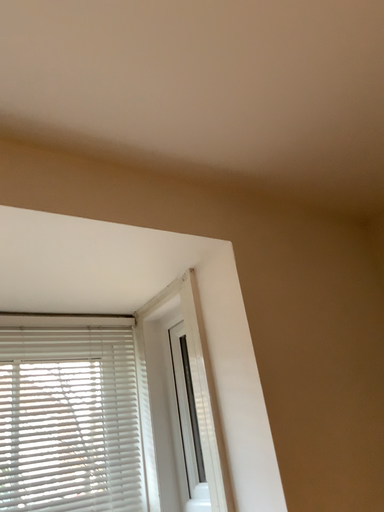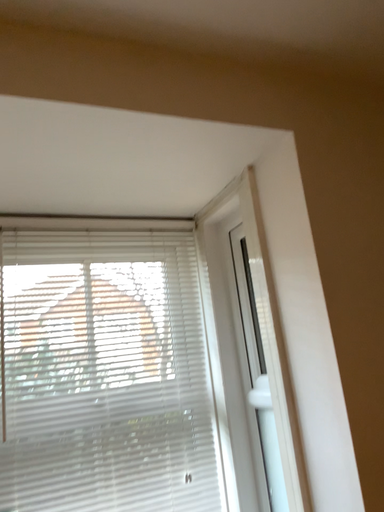
Question: How did the camera likely rotate when shooting the video?

Choices:
 (A) rotated right
 (B) rotated left

Answer: (B)